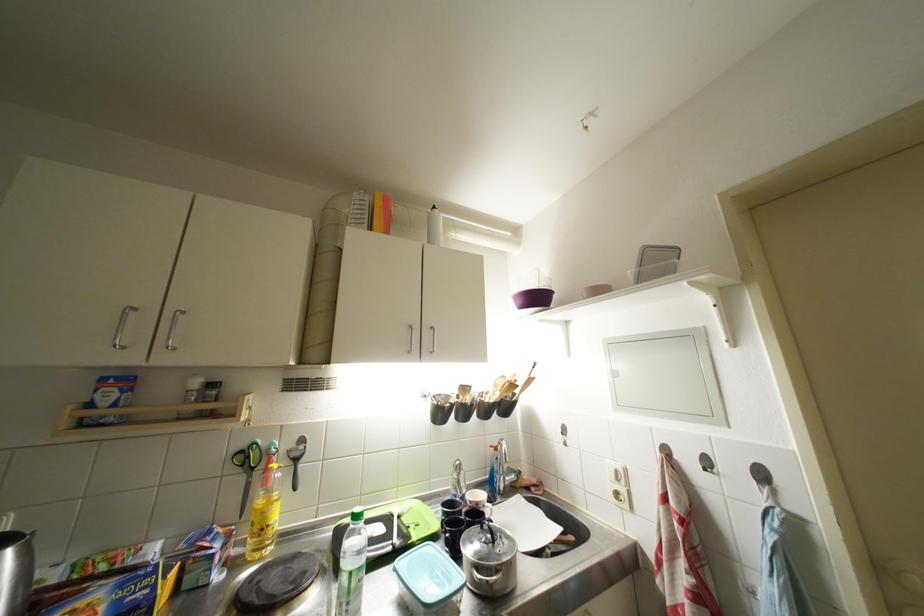
The image size is (924, 616). What are the coordinates of `black pot lid handle` in the screenshot? It's located at (492, 535).